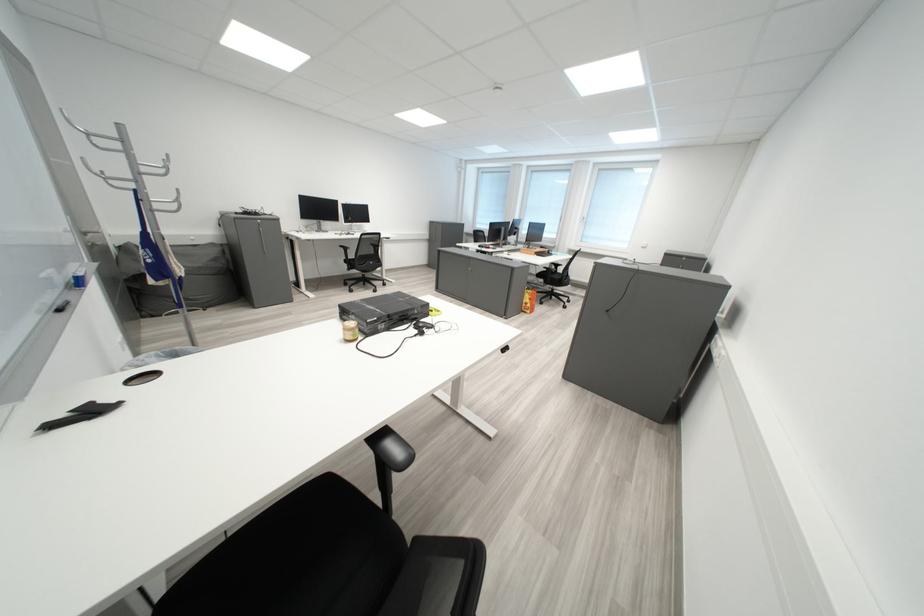
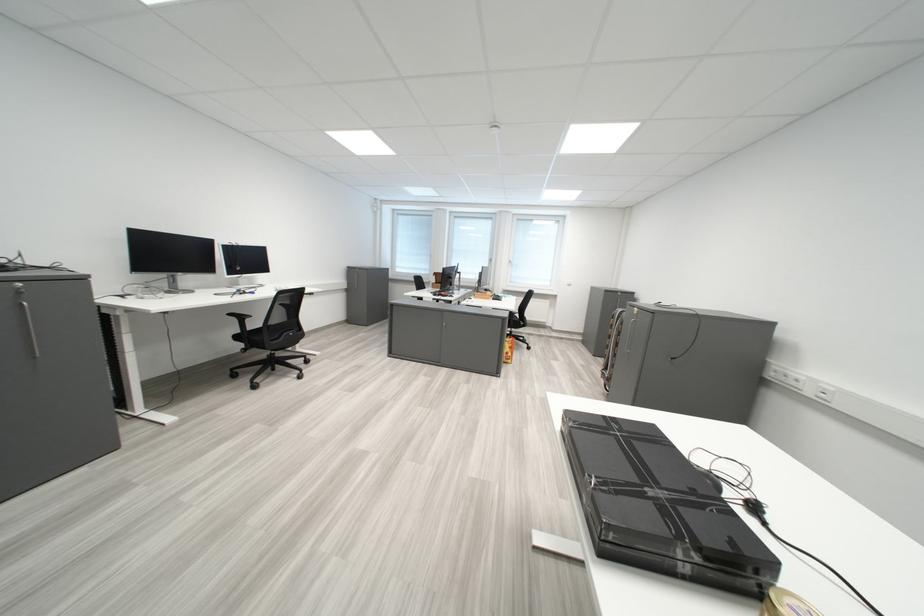
In a continuous first-person perspective shot, in which direction is the camera moving?

The cameraman moved toward left, forward.